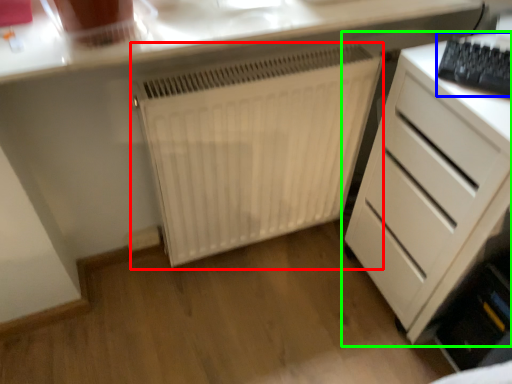
Question: Estimate the real-world distances between objects in this image. Which object is farther from radiator (highlighted by a red box), keyboard (highlighted by a blue box) or chest of drawers (highlighted by a green box)?

Choices:
 (A) keyboard
 (B) chest of drawers

Answer: (A)